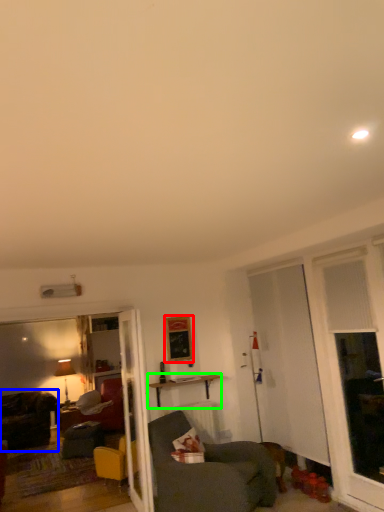
Question: Which object is positioned closest to picture frame (highlighted by a red box)? Select from chair (highlighted by a blue box) and table (highlighted by a green box).

Choices:
 (A) chair
 (B) table

Answer: (B)